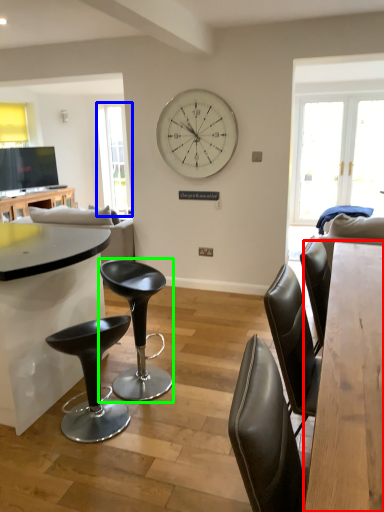
Question: Estimate the real-world distances between objects in this image. Which object is closer to table (highlighted by a red box), window screen (highlighted by a blue box) or chair (highlighted by a green box)?

Choices:
 (A) window screen
 (B) chair

Answer: (B)